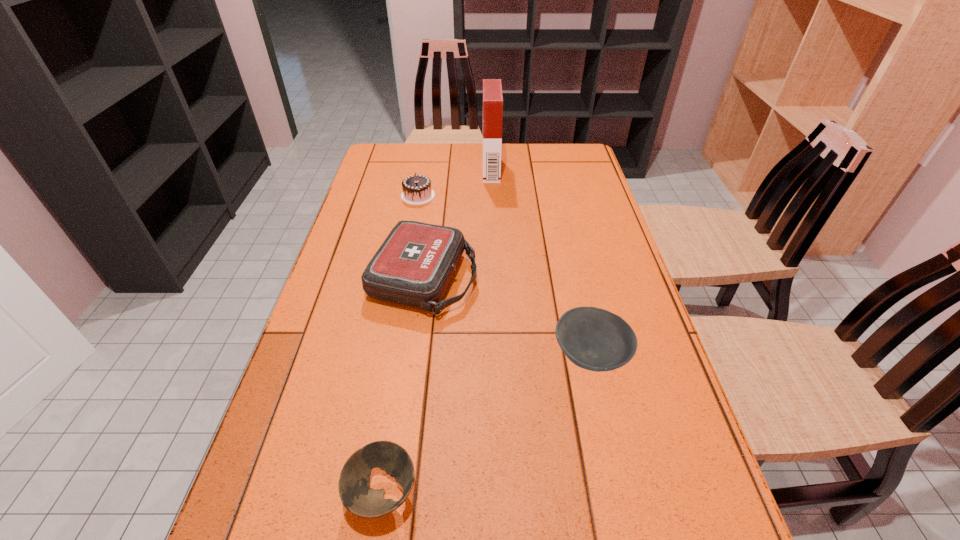
Locate an element on the screen. The width and height of the screenshot is (960, 540). cigarette_case is located at coordinates (492, 88).

Locate an element on the screen. the fourth object from left to right is located at coordinates (492, 88).

Locate an element on the screen. Image resolution: width=960 pixels, height=540 pixels. the first-aid kit is located at coordinates [x=414, y=265].

The height and width of the screenshot is (540, 960). In order to click on the second farthest object in this screenshot , I will do `click(417, 190)`.

Identify the location of the right bowl. The width and height of the screenshot is (960, 540). (594, 339).

Where is `the farther bowl`? The width and height of the screenshot is (960, 540). the farther bowl is located at coordinates (594, 339).

Identify the location of the shortest object. This screenshot has height=540, width=960. (356, 496).

Identify the location of the left bowl. (356, 496).

This screenshot has width=960, height=540. Identify the location of vacant space located 0.130m on the front-facing side of the fourth object from left to right. (446, 170).

Where is `vacant space located on the front-facing side of the fourth object from left to right`? vacant space located on the front-facing side of the fourth object from left to right is located at coordinates (379, 170).